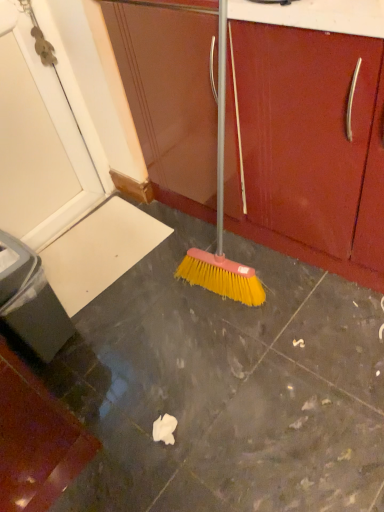
Question: Is yellow bristle broom at center closer to camera compared to matte wood cabinet at center?

Choices:
 (A) yes
 (B) no

Answer: (A)

Question: Considering the relative sizes of yellow bristle broom at center and matte wood cabinet at center in the image provided, is yellow bristle broom at center thinner than matte wood cabinet at center?

Choices:
 (A) yes
 (B) no

Answer: (B)

Question: From the image's perspective, is yellow bristle broom at center beneath matte wood cabinet at center?

Choices:
 (A) no
 (B) yes

Answer: (B)

Question: Does yellow bristle broom at center have a greater width compared to matte wood cabinet at center?

Choices:
 (A) yes
 (B) no

Answer: (A)

Question: Is matte wood cabinet at center completely or partially inside yellow bristle broom at center?

Choices:
 (A) no
 (B) yes

Answer: (A)

Question: From a real-world perspective, is yellow bristle broom at center on top of matte wood cabinet at center?

Choices:
 (A) yes
 (B) no

Answer: (B)

Question: From the image's perspective, is matte wood cabinet at center under yellow bristle broom at center?

Choices:
 (A) no
 (B) yes

Answer: (A)

Question: Is matte wood cabinet at center touching yellow bristle broom at center?

Choices:
 (A) no
 (B) yes

Answer: (B)

Question: Is matte wood cabinet at center in front of yellow bristle broom at center?

Choices:
 (A) no
 (B) yes

Answer: (A)

Question: Is matte wood cabinet at center positioned far away from yellow bristle broom at center?

Choices:
 (A) yes
 (B) no

Answer: (B)

Question: Is matte wood cabinet at center bigger than yellow bristle broom at center?

Choices:
 (A) yes
 (B) no

Answer: (B)

Question: Is matte wood cabinet at center thinner than yellow bristle broom at center?

Choices:
 (A) yes
 (B) no

Answer: (A)

Question: Considering the positions of yellow bristle broom at center and matte wood cabinet at center in the image, is yellow bristle broom at center taller or shorter than matte wood cabinet at center?

Choices:
 (A) tall
 (B) short

Answer: (B)